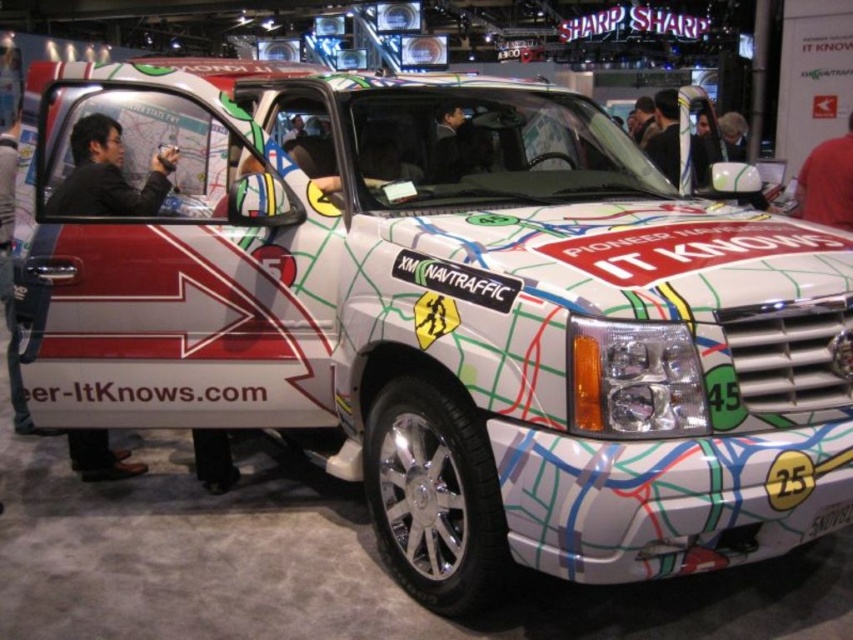
You are a photographer at the exhibition and need to capture a clear shot of the white SUV with both the red shirt at upper right and the black leather jacket at upper center in the frame. Based on their sizes, which clothing item will appear smaller in the photo?

The red shirt at upper right has a lesser width compared to the black leather jacket at upper center, so it will appear smaller in the photo.

You are standing at the exhibition and want to take a photo of the white SUV with both the point at (113,464) and the point at (810,156) clearly visible. Since you want the closer point to be in focus, which point should you focus on?

You should focus on point (113,464) because it is closer to the camera than point (810,156), ensuring it stays in focus while the other point may appear slightly blurred.